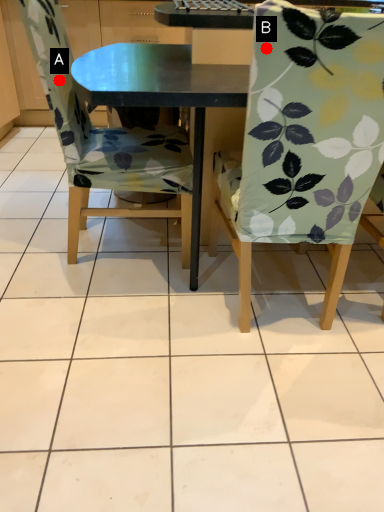
Question: Two points are circled on the image, labeled by A and B beside each circle. Which point is further to the camera?

Choices:
 (A) A is further
 (B) B is further

Answer: (A)